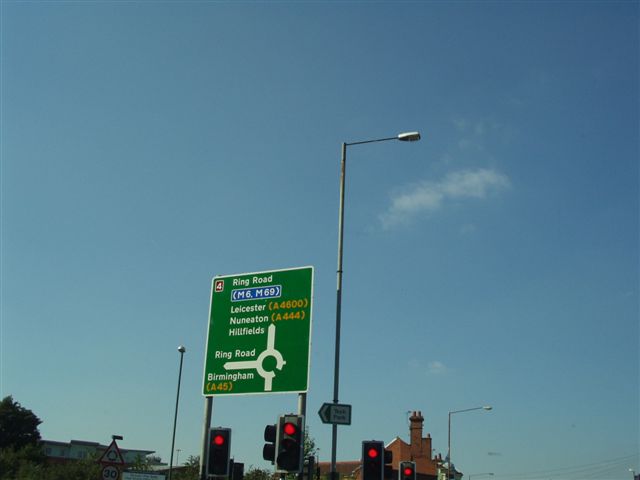
At what (x,y) coordinates should I click in order to perform the action: click on chimney. Please return your answer as a coordinate pair (x, y). This screenshot has height=480, width=640. Looking at the image, I should click on (418, 432).